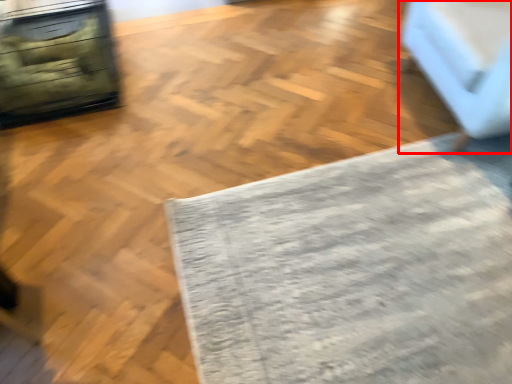
Question: Where is furniture (annotated by the red box) located in relation to mat in the image?

Choices:
 (A) left
 (B) right

Answer: (B)